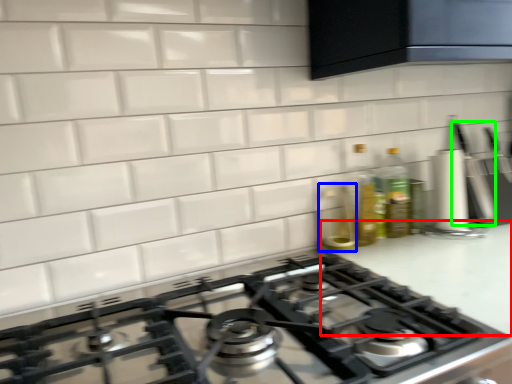
Question: Considering the real-world distances, which object is closest to counter top (highlighted by a red box)? appliance (highlighted by a blue box) or kitchen appliance (highlighted by a green box).

Choices:
 (A) appliance
 (B) kitchen appliance

Answer: (A)